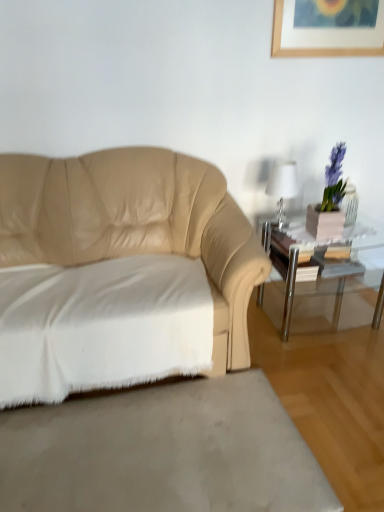
Question: Considering the relative sizes of clear glass table at right and white soft rug at lower left in the image provided, is clear glass table at right bigger than white soft rug at lower left?

Choices:
 (A) yes
 (B) no

Answer: (A)

Question: From the image's perspective, is clear glass table at right above white soft rug at lower left?

Choices:
 (A) no
 (B) yes

Answer: (B)

Question: Does clear glass table at right lie behind white soft rug at lower left?

Choices:
 (A) yes
 (B) no

Answer: (A)

Question: Is clear glass table at right thinner than white soft rug at lower left?

Choices:
 (A) yes
 (B) no

Answer: (A)

Question: Does clear glass table at right come in front of white soft rug at lower left?

Choices:
 (A) yes
 (B) no

Answer: (B)

Question: Is white cotton sheet at lower left in front of or behind white soft rug at lower left in the image?

Choices:
 (A) behind
 (B) front

Answer: (A)

Question: From a real-world perspective, relative to white soft rug at lower left, is white cotton sheet at lower left vertically above or below?

Choices:
 (A) above
 (B) below

Answer: (A)

Question: Considering the positions of point (107, 281) and point (238, 461), is point (107, 281) closer or farther from the camera than point (238, 461)?

Choices:
 (A) closer
 (B) farther

Answer: (B)

Question: Is white cotton sheet at lower left bigger or smaller than white soft rug at lower left?

Choices:
 (A) small
 (B) big

Answer: (B)

Question: In terms of width, does white glossy table lamp at upper right look wider or thinner when compared to white soft rug at lower left?

Choices:
 (A) thin
 (B) wide

Answer: (A)

Question: Considering the relative positions of white glossy table lamp at upper right and white soft rug at lower left in the image provided, is white glossy table lamp at upper right to the left or to the right of white soft rug at lower left?

Choices:
 (A) right
 (B) left

Answer: (A)

Question: Relative to white soft rug at lower left, is white glossy table lamp at upper right in front or behind?

Choices:
 (A) front
 (B) behind

Answer: (B)

Question: Looking at the image, does white glossy table lamp at upper right seem bigger or smaller compared to white soft rug at lower left?

Choices:
 (A) big
 (B) small

Answer: (B)

Question: Considering the positions of white cotton sheet at lower left and beige leather couch at left in the image, is white cotton sheet at lower left taller or shorter than beige leather couch at left?

Choices:
 (A) tall
 (B) short

Answer: (B)

Question: Relative to beige leather couch at left, is white cotton sheet at lower left in front or behind?

Choices:
 (A) behind
 (B) front

Answer: (A)